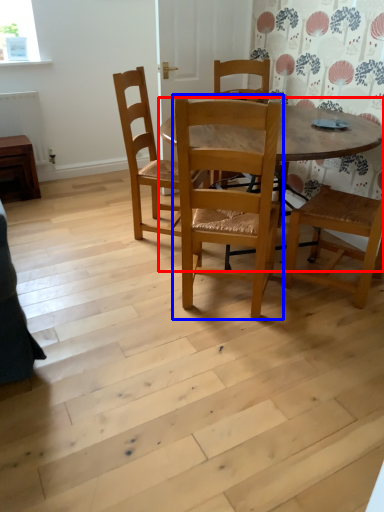
Question: Which object is further to the camera taking this photo, kitchen & dining room table (highlighted by a red box) or chair (highlighted by a blue box)?

Choices:
 (A) kitchen & dining room table
 (B) chair

Answer: (A)